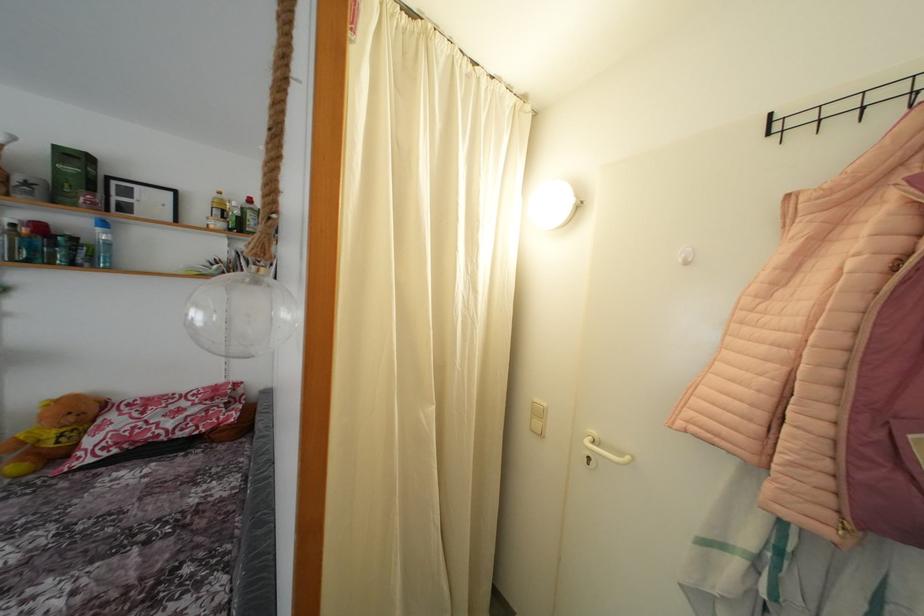
Where would you hang the black wall hook? Please return your answer as a coordinate pair (x, y).

(845, 106)